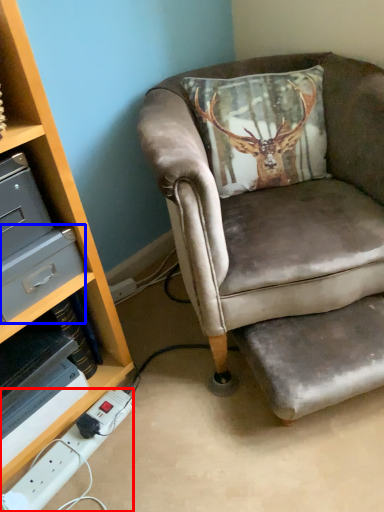
Question: Which object appears closest to the camera in this image, power outlet (highlighted by a red box) or drawer (highlighted by a blue box)?

Choices:
 (A) power outlet
 (B) drawer

Answer: (B)